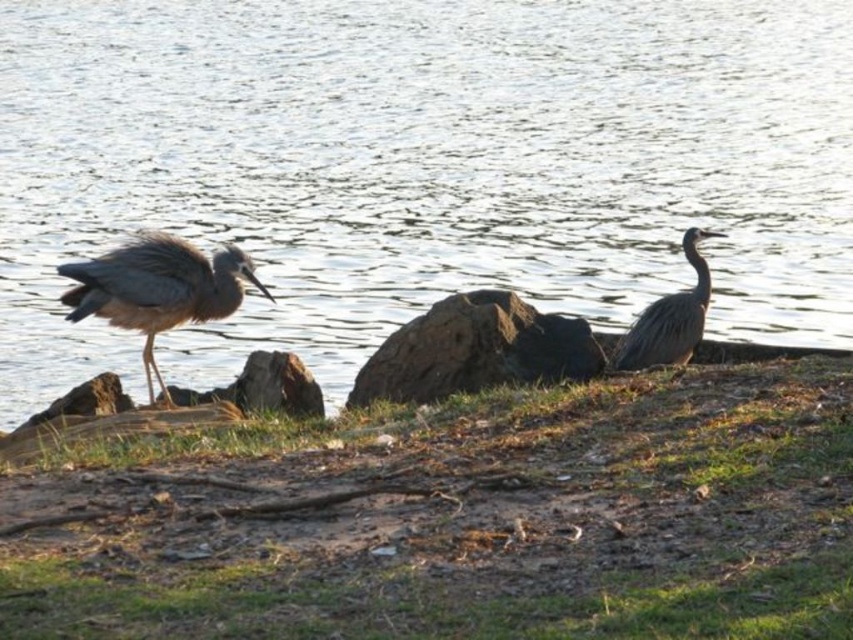
Question: Which point appears closest to the camera in this image?

Choices:
 (A) (361, 563)
 (B) (511, 164)
 (C) (171, 260)
 (D) (695, 248)

Answer: (A)

Question: Is brown rough rock at center positioned behind gray matte heron at left?

Choices:
 (A) yes
 (B) no

Answer: (A)

Question: Observing the image, what is the correct spatial positioning of green grass at lower center in reference to gray feathered heron at right?

Choices:
 (A) left
 (B) right

Answer: (A)

Question: Which object is farther from the camera taking this photo?

Choices:
 (A) green grass at lower center
 (B) brown rough rock at center

Answer: (B)

Question: Does brown rough rock at center have a greater width compared to gray feathered heron at right?

Choices:
 (A) no
 (B) yes

Answer: (B)

Question: Among these objects, which one is farthest from the camera?

Choices:
 (A) gray feathered heron at right
 (B) green grass at lower center
 (C) brown rough rock at center
 (D) clear water at center

Answer: (A)